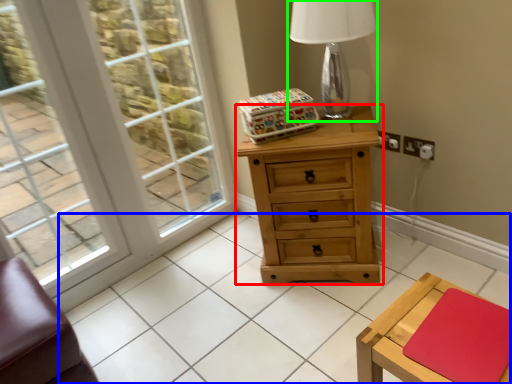
Question: Which object is positioned closest to chest of drawers (highlighted by a red box)? Select from tile (highlighted by a blue box) and table lamp (highlighted by a green box).

Choices:
 (A) tile
 (B) table lamp

Answer: (B)